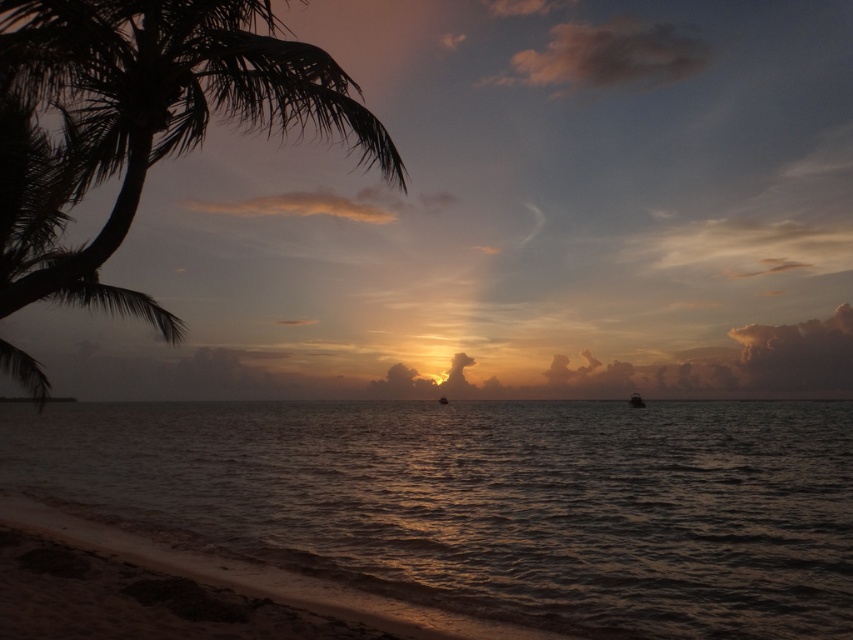
You are a photographer trying to capture the sunset. You have two subjects in your frame, the dull metallic water at center and the metallic silver boat at center. Which one appears larger in height in the photo?

The dull metallic water at center appears much taller than the metallic silver boat at center in the photo.

You are a photographer trying to capture the metallic silver boat at center and the dull metallic water at center in a single frame. Based on their positions, which object should you focus on first to ensure both are in the shot?

The dull metallic water at center is to the left of the metallic silver boat at center, so you should focus on the metallic silver boat at center first to ensure both are in the shot.